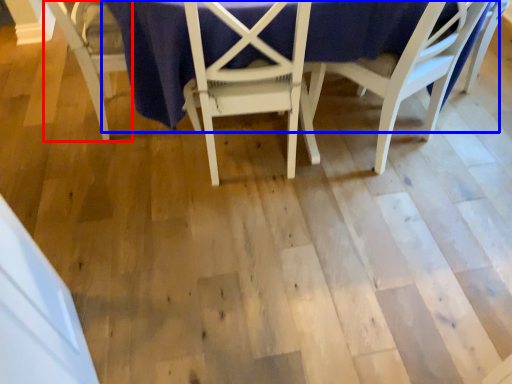
Question: Which point is further to the camera, chair (highlighted by a red box) or table (highlighted by a blue box)?

Choices:
 (A) chair
 (B) table

Answer: (A)